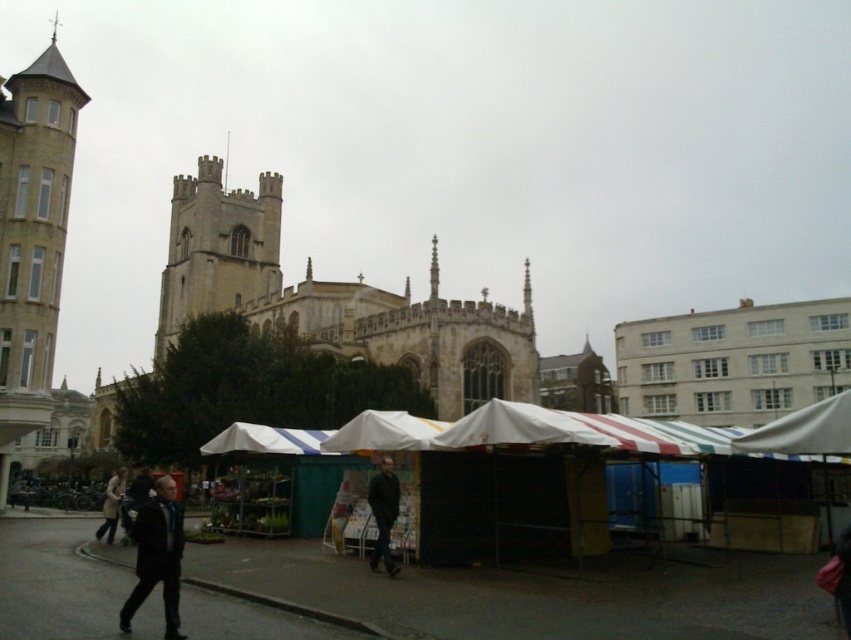
Does dark gray jacket at center appear on the right side of light brown leather coat at lower left?

Yes, dark gray jacket at center is to the right of light brown leather coat at lower left.

Is dark gray jacket at center below light brown leather coat at lower left?

No, dark gray jacket at center is not below light brown leather coat at lower left.

Where is `dark gray jacket at center`? This screenshot has width=851, height=640. dark gray jacket at center is located at coordinates (383, 513).

Find the location of `dark gray jacket at center`. dark gray jacket at center is located at coordinates (383, 513).

Who is taller, light brown stone tower at left or light brown leather coat at lower left?

Standing taller between the two is light brown stone tower at left.

Is point (1, 305) behind point (111, 504)?

Yes.

Locate an element on the screen. light brown stone tower at left is located at coordinates (32, 237).

Can you confirm if dark gray suit at lower left is positioned below light brown leather coat at lower left?

Actually, dark gray suit at lower left is above light brown leather coat at lower left.

Which is more to the right, dark gray suit at lower left or light brown leather coat at lower left?

From the viewer's perspective, dark gray suit at lower left appears more on the right side.

The image size is (851, 640). Describe the element at coordinates (157, 556) in the screenshot. I see `dark gray suit at lower left` at that location.

Locate an element on the screen. dark gray suit at lower left is located at coordinates (157, 556).